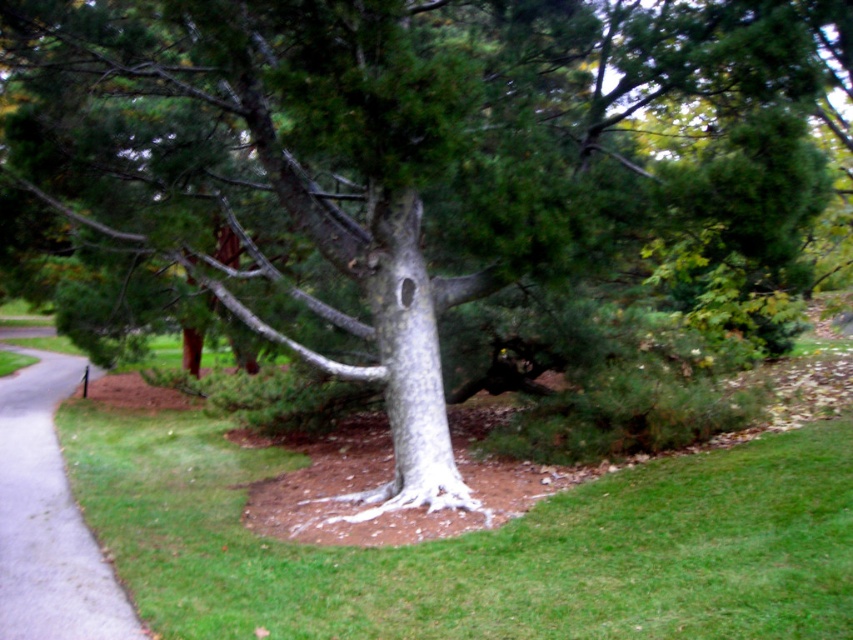
Question: Which point is closer to the camera taking this photo?

Choices:
 (A) (45, 564)
 (B) (410, 460)

Answer: (A)

Question: Considering the relative positions of gray asphalt pavement at lower left and white textured bark at center in the image provided, where is gray asphalt pavement at lower left located with respect to white textured bark at center?

Choices:
 (A) below
 (B) above

Answer: (A)

Question: Does gray asphalt pavement at lower left have a smaller size compared to white textured bark at center?

Choices:
 (A) yes
 (B) no

Answer: (B)

Question: Which point is closer to the camera taking this photo?

Choices:
 (A) (396, 404)
 (B) (21, 502)

Answer: (A)

Question: Does gray asphalt pavement at lower left lie behind white textured bark at center?

Choices:
 (A) yes
 (B) no

Answer: (B)

Question: Among these points, which one is farthest from the camera?

Choices:
 (A) (409, 353)
 (B) (65, 358)

Answer: (B)